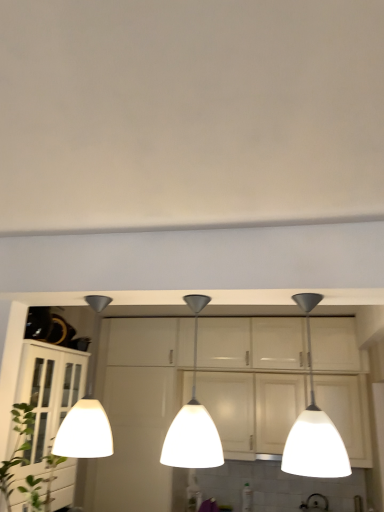
Question: Are green leafy plant at lower left and white glass pendant light at center, which ranks as the second lamp in left-to-right order, located far from each other?

Choices:
 (A) no
 (B) yes

Answer: (A)

Question: Is green leafy plant at lower left thinner than white glass pendant light at center, which ranks as the second lamp in right-to-left order?

Choices:
 (A) no
 (B) yes

Answer: (A)

Question: Is white glass pendant light at center, which ranks as the second lamp in right-to-left order, at the back of green leafy plant at lower left?

Choices:
 (A) yes
 (B) no

Answer: (B)

Question: From a real-world perspective, is green leafy plant at lower left below white glass pendant light at center, which ranks as the second lamp in right-to-left order?

Choices:
 (A) no
 (B) yes

Answer: (B)

Question: Would you say green leafy plant at lower left is outside white glass pendant light at center, which ranks as the second lamp in left-to-right order?

Choices:
 (A) no
 (B) yes

Answer: (B)

Question: Is point (36, 498) closer or farther from the camera than point (69, 444)?

Choices:
 (A) farther
 (B) closer

Answer: (A)

Question: Relative to white glossy pendant light at left, which is the first lamp in left-to-right order, is green leafy plant at lower left in front or behind?

Choices:
 (A) front
 (B) behind

Answer: (A)

Question: From the image's perspective, is green leafy plant at lower left above or below white glossy pendant light at left, which is the first lamp in left-to-right order?

Choices:
 (A) below
 (B) above

Answer: (A)

Question: Is green leafy plant at lower left wider or thinner than white glossy pendant light at left, which is the first lamp in left-to-right order?

Choices:
 (A) thin
 (B) wide

Answer: (B)

Question: Is white glass pendant light at center, which ranks as the second lamp in right-to-left order, in front of or behind white glossy lampshade at right, which appears as the first lamp when viewed from the right, in the image?

Choices:
 (A) behind
 (B) front

Answer: (A)

Question: In terms of size, does white glass pendant light at center, which ranks as the second lamp in left-to-right order, appear bigger or smaller than white glossy lampshade at right, positioned as the 3th lamp in left-to-right order?

Choices:
 (A) small
 (B) big

Answer: (A)

Question: Is white glass pendant light at center, which ranks as the second lamp in right-to-left order, inside the boundaries of white glossy lampshade at right, positioned as the 3th lamp in left-to-right order, or outside?

Choices:
 (A) outside
 (B) inside

Answer: (A)

Question: Looking at their shapes, would you say white glass pendant light at center, which ranks as the second lamp in left-to-right order, is wider or thinner than white glossy lampshade at right, positioned as the 3th lamp in left-to-right order?

Choices:
 (A) wide
 (B) thin

Answer: (B)

Question: In terms of width, does white glossy pendant light at left, which is the first lamp in left-to-right order, look wider or thinner when compared to green leafy plant at lower left?

Choices:
 (A) wide
 (B) thin

Answer: (B)

Question: Is white glossy pendant light at left, arranged as the third lamp when viewed from the right, in front of or behind green leafy plant at lower left in the image?

Choices:
 (A) front
 (B) behind

Answer: (B)